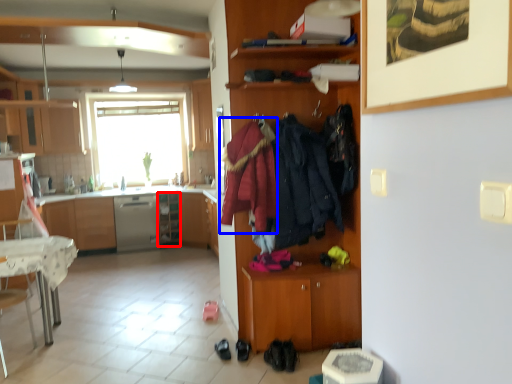
Question: Which object appears farthest to the camera in this image, shelf (highlighted by a red box) or clothing (highlighted by a blue box)?

Choices:
 (A) shelf
 (B) clothing

Answer: (A)